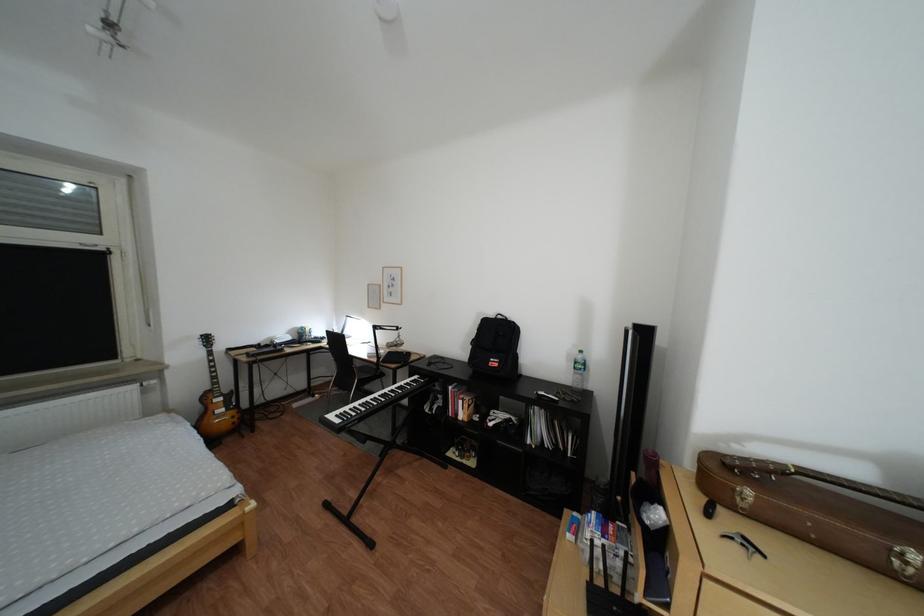
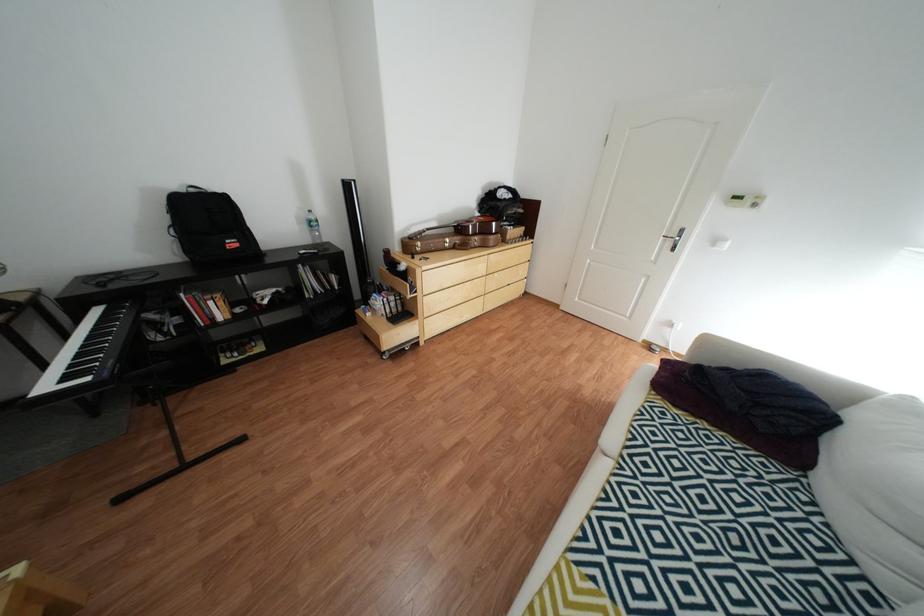
How did the camera likely rotate?

The rotation direction of the camera is right-down.